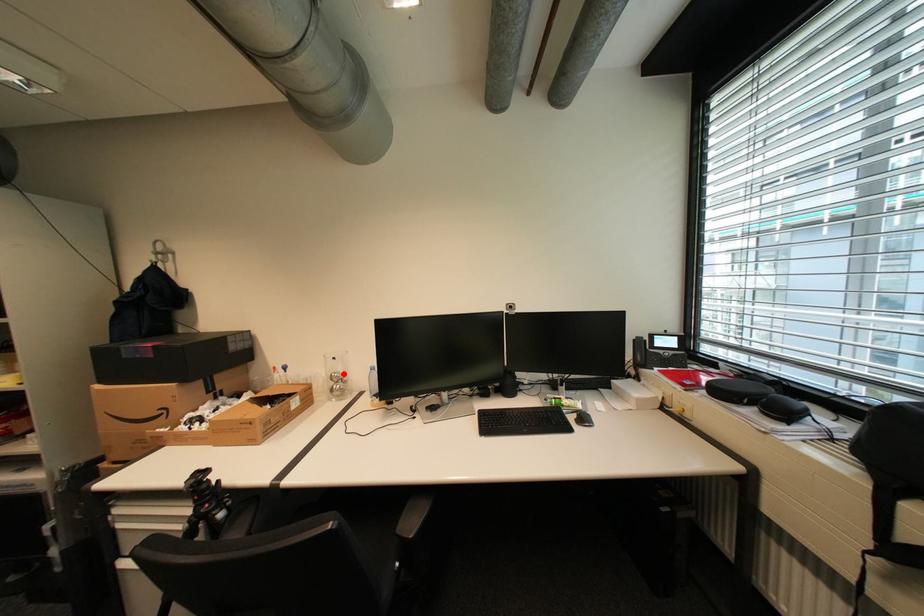
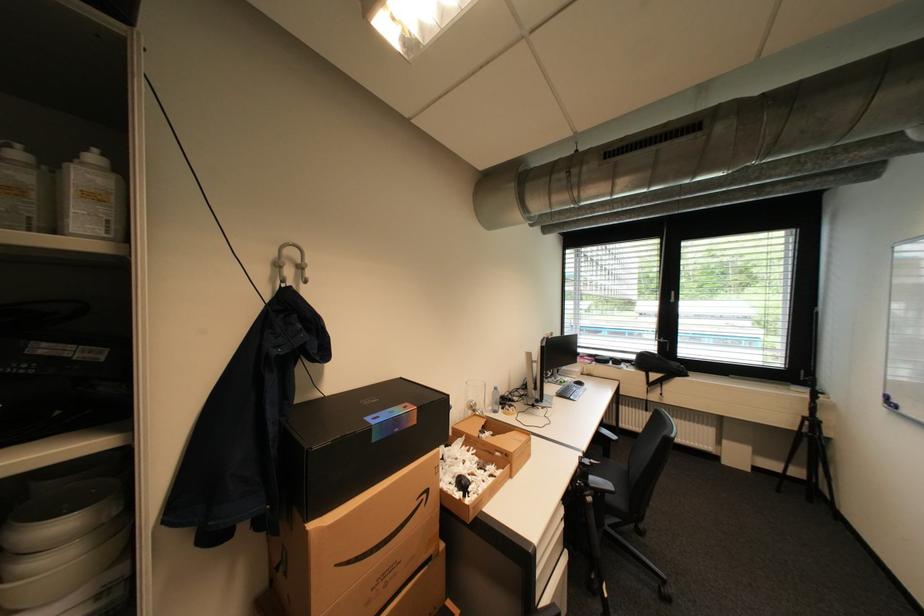
In the second image, find the point that corresponds to the highlighted location in the first image.

(480, 402)